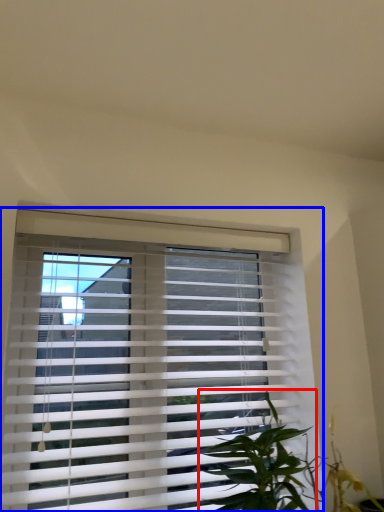
Question: Which object is further to the camera taking this photo, vegetation (highlighted by a red box) or window blind (highlighted by a blue box)?

Choices:
 (A) vegetation
 (B) window blind

Answer: (B)